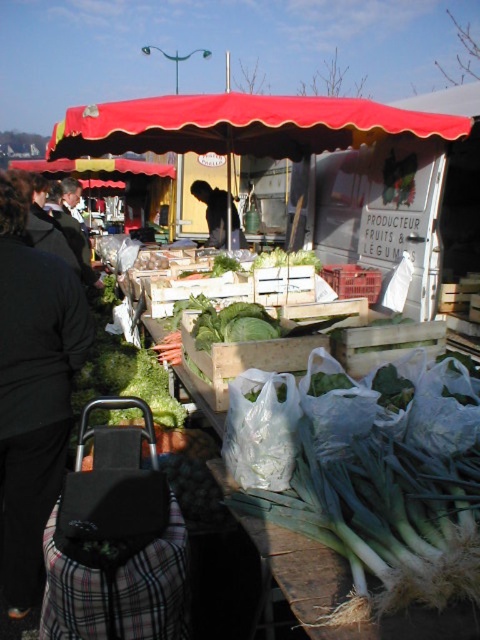
Is red fabric canopy at upper center to the right of black fabric at center from the viewer's perspective?

Correct, you'll find red fabric canopy at upper center to the right of black fabric at center.

Is red fabric canopy at upper center in front of black fabric at center?

Yes, it is.

Does point (292, 113) come behind point (223, 200)?

No, it is in front of (223, 200).

The height and width of the screenshot is (640, 480). In order to click on red fabric canopy at upper center in this screenshot , I will do `click(240, 125)`.

Who is taller, green leafy at center or black fabric at center?

With more height is black fabric at center.

Is point (272, 317) positioned after point (226, 230)?

No, (272, 317) is in front of (226, 230).

Is point (243, 317) closer to viewer compared to point (215, 225)?

Yes.

Find the location of a particular element. The image size is (480, 640). green leafy at center is located at coordinates (233, 324).

Consider the image. Is black fabric bag at lower left positioned at the back of green leafy at center?

That is False.

Is black fabric bag at lower left taller than green leafy at center?

Yes, black fabric bag at lower left is taller than green leafy at center.

The height and width of the screenshot is (640, 480). Describe the element at coordinates (33, 390) in the screenshot. I see `black fabric bag at lower left` at that location.

This screenshot has height=640, width=480. I want to click on black fabric bag at lower left, so click(x=33, y=390).